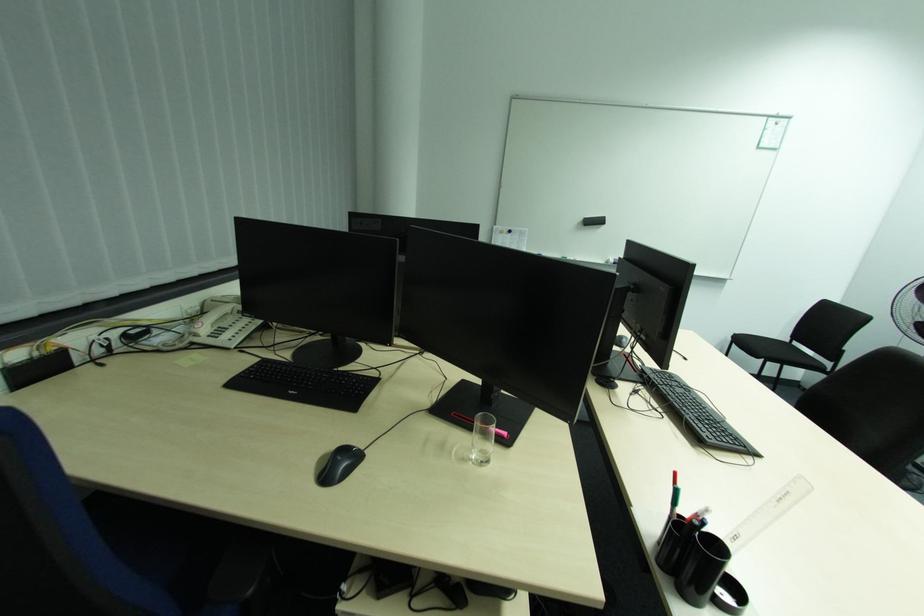
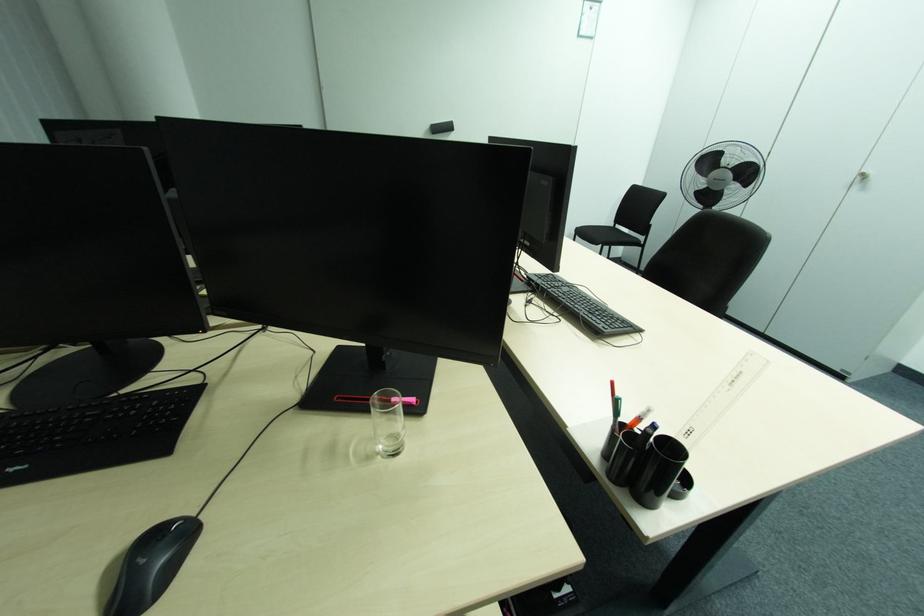
Question: The camera is either moving clockwise (left) or counter-clockwise (right) around the object. The first image is from the beginning of the video and the second image is from the end. Is the camera moving left or right when shooting the video?

Choices:
 (A) Left
 (B) Right

Answer: (A)